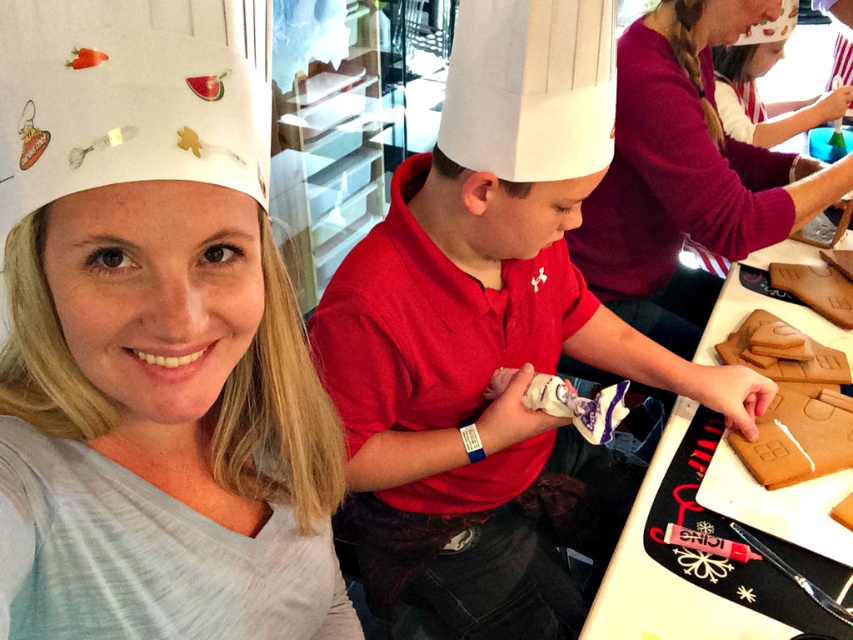
You are a photographer standing in the workshop and want to take a picture of both the white frosted gingerbread house at center and the brown matte gingerbread house at right. Which one will appear larger in the photo?

The white frosted gingerbread house at center will appear larger in the photo because it is closer to the viewer than the brown matte gingerbread house at right.

You are a participant in the gingerbread decorating workshop and need to place a small candy cane on the taller gingerbread house. Which one should you choose between the white frosted gingerbread house at center and the brown matte gingerbread house at right?

The brown matte gingerbread house at right is taller than the white frosted gingerbread house at center, so you should place the candy cane on the brown matte gingerbread house at right.